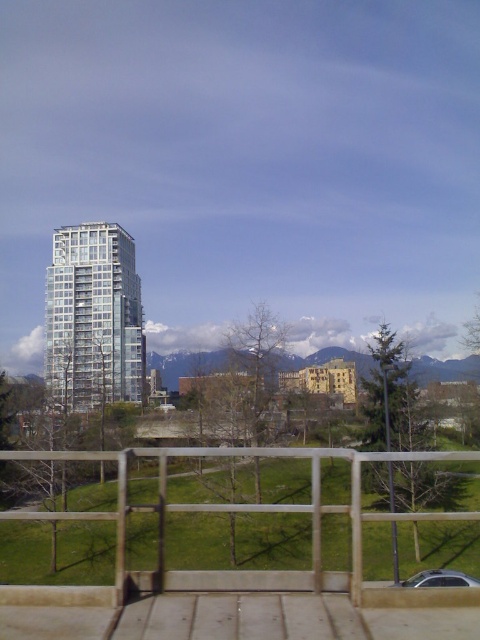
You are standing on the bridge looking at two points in the scene. The first point is at coordinates point (334, 614) and the second is at point (108, 330). Which point is closer to you?

Point (334, 614) is closer to the camera than point (108, 330).

You are standing on a bridge and see the wooden at lower center and the clear glass building at center. Which object is positioned to the right of the other?

The wooden at lower center is positioned to the right of the clear glass building at center.

You are a photographer planning to capture the clear glass building at center from the wooden at lower center. Considering the spatial relationship between them, can you fit the entire building into your camera frame without moving your position?

The wooden at lower center might be wider than clear glass building at center, so it is possible to fit the entire building into the camera frame without moving your position.